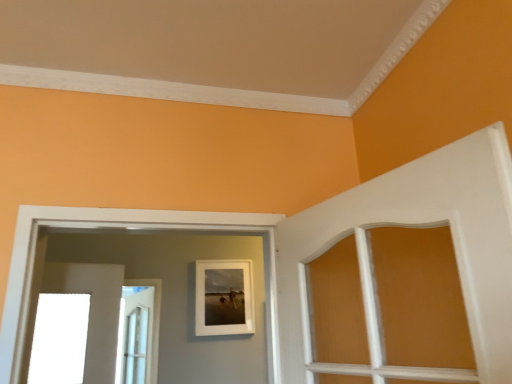
Question: Does white matte picture frame at center have a lesser height compared to white glossy door at left?

Choices:
 (A) yes
 (B) no

Answer: (A)

Question: Is white matte picture frame at center not near white glossy door at left?

Choices:
 (A) no
 (B) yes

Answer: (A)

Question: Can you confirm if white matte picture frame at center is bigger than white glossy door at left?

Choices:
 (A) no
 (B) yes

Answer: (B)

Question: Does white matte picture frame at center have a lesser width compared to white glossy door at left?

Choices:
 (A) yes
 (B) no

Answer: (B)

Question: Is white matte picture frame at center positioned with its back to white glossy door at left?

Choices:
 (A) yes
 (B) no

Answer: (B)

Question: Would you say white matte picture frame at center is outside white glossy door at left?

Choices:
 (A) no
 (B) yes

Answer: (B)

Question: Is white glossy door at left thinner than white matte picture frame at center?

Choices:
 (A) no
 (B) yes

Answer: (B)

Question: Is white glossy door at left further to the viewer compared to white matte picture frame at center?

Choices:
 (A) yes
 (B) no

Answer: (A)

Question: From a real-world perspective, is white glossy door at left on white matte picture frame at center?

Choices:
 (A) no
 (B) yes

Answer: (A)

Question: Considering the relative sizes of white glossy door at left and white matte picture frame at center in the image provided, is white glossy door at left taller than white matte picture frame at center?

Choices:
 (A) yes
 (B) no

Answer: (A)

Question: Considering the relative sizes of white glossy door at left and white matte picture frame at center in the image provided, is white glossy door at left shorter than white matte picture frame at center?

Choices:
 (A) yes
 (B) no

Answer: (B)

Question: From the image's perspective, is white glossy door at left over white matte picture frame at center?

Choices:
 (A) yes
 (B) no

Answer: (B)

Question: From their relative heights in the image, would you say white glossy door at left is taller or shorter than white matte picture frame at center?

Choices:
 (A) short
 (B) tall

Answer: (B)